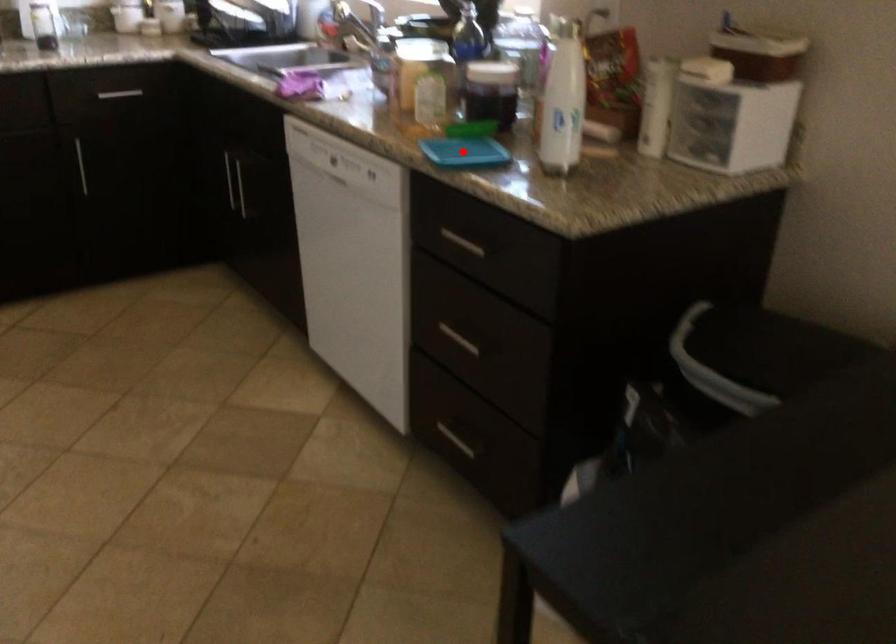
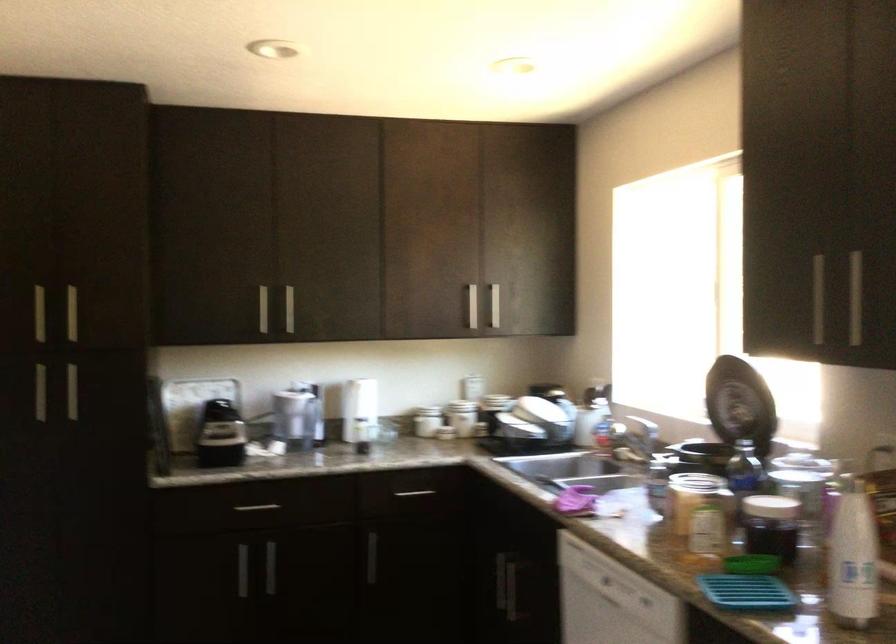
Where in the second image is the point corresponding to the highlighted location from the first image?

(745, 592)